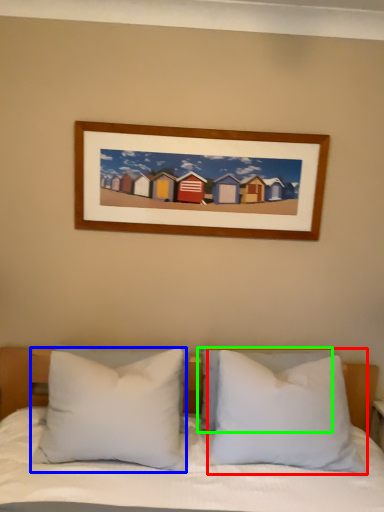
Question: Considering the real-world distances, which object is farthest from pillow (highlighted by a red box)? pillow (highlighted by a blue box) or pillow (highlighted by a green box)?

Choices:
 (A) pillow
 (B) pillow

Answer: (A)